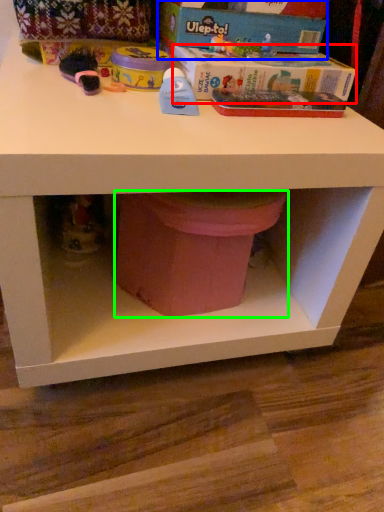
Question: Estimate the real-world distances between objects in this image. Which object is farther from box (highlighted by a red box), box (highlighted by a blue box) or potty (highlighted by a green box)?

Choices:
 (A) box
 (B) potty

Answer: (B)